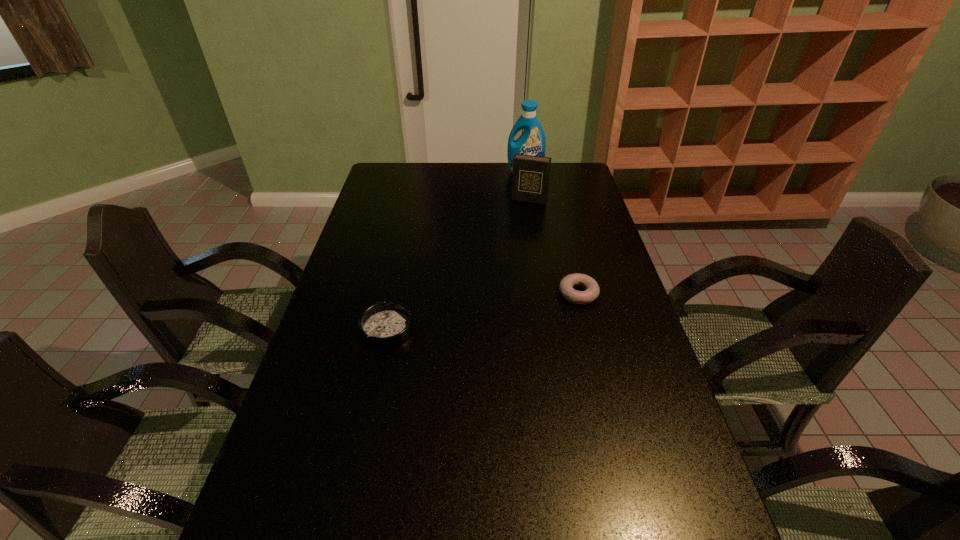
At what (x,y) coordinates should I click in order to perform the action: click on free spot on the desktop that is between the leftmost object and the third farthest object and is positioned on the front cover of the diary. Please return your answer as a coordinate pair (x, y). The image size is (960, 540). Looking at the image, I should click on (491, 310).

In order to click on vacant space on the desktop that is between the nearest object and the second nearest object and is positioned on the front-facing side of the farthest object in this screenshot , I will do `click(505, 307)`.